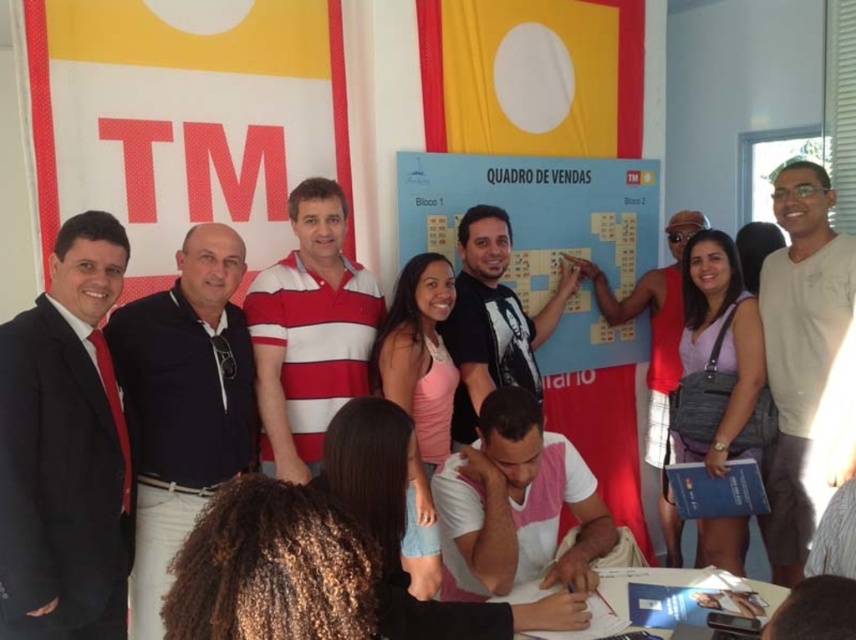
Question: Which object is the closest to the light beige t-shirt at right?

Choices:
 (A) black t-shirt at center
 (B) dark blue polo shirt at left
 (C) blue matte board at center

Answer: (C)

Question: Estimate the real-world distances between objects in this image. Which object is farther from the blue matte board at center?

Choices:
 (A) pink cotton t-shirt at center
 (B) dark blue polo shirt at left
 (C) white striped polo shirt at center
 (D) light beige t-shirt at right

Answer: (B)

Question: Does matte black suit at left have a lesser width compared to dark blue polo shirt at left?

Choices:
 (A) no
 (B) yes

Answer: (B)

Question: Is white striped polo shirt at center below pink cotton t-shirt at center?

Choices:
 (A) yes
 (B) no

Answer: (B)

Question: Among these objects, which one is farthest from the camera?

Choices:
 (A) blue matte board at center
 (B) pink cotton t-shirt at center

Answer: (A)

Question: Considering the relative positions of dark blue polo shirt at left and black t-shirt at center in the image provided, where is dark blue polo shirt at left located with respect to black t-shirt at center?

Choices:
 (A) right
 (B) left

Answer: (B)